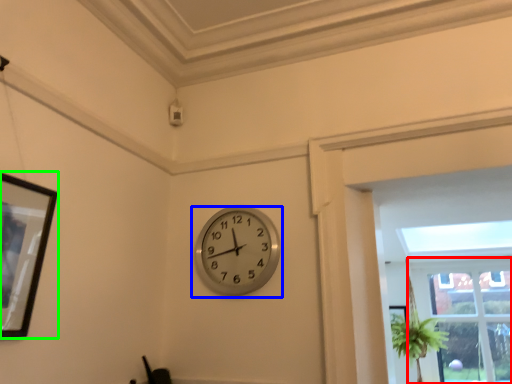
Question: Based on their relative distances, which object is nearer to window (highlighted by a red box)? Choose from wall clock (highlighted by a blue box) and picture frame (highlighted by a green box).

Choices:
 (A) wall clock
 (B) picture frame

Answer: (A)